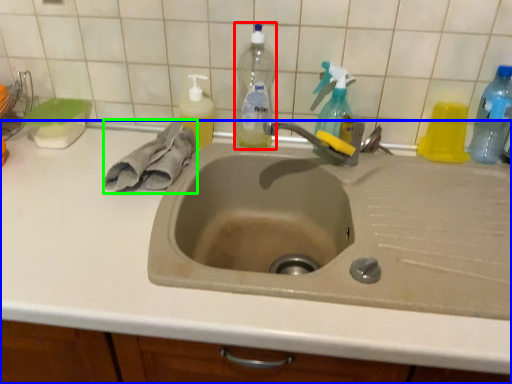
Question: Considering the real-world distances, which object is closest to bottle (highlighted by a red box)? countertop (highlighted by a blue box) or hand towel (highlighted by a green box).

Choices:
 (A) countertop
 (B) hand towel

Answer: (B)